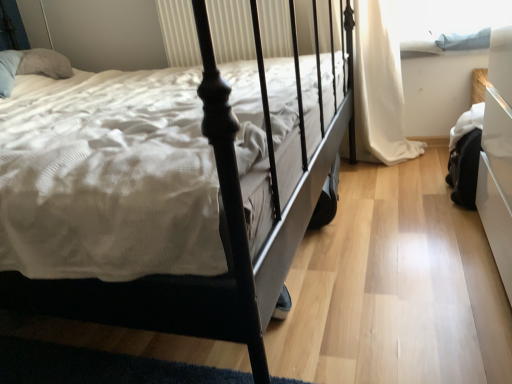
Question: Based on their sizes in the image, would you say blue fabric at upper right is bigger or smaller than white fabric curtain at right?

Choices:
 (A) small
 (B) big

Answer: (A)

Question: Looking at their shapes, would you say blue fabric at upper right is wider or thinner than white fabric curtain at right?

Choices:
 (A) wide
 (B) thin

Answer: (A)

Question: Considering the real-world distances, which object is closest to the matte black bed at center?

Choices:
 (A) white fabric curtain at right
 (B) blue fabric at upper right

Answer: (A)

Question: Which object is the farthest from the blue fabric at upper right?

Choices:
 (A) matte black bed at center
 (B) white fabric curtain at right

Answer: (A)